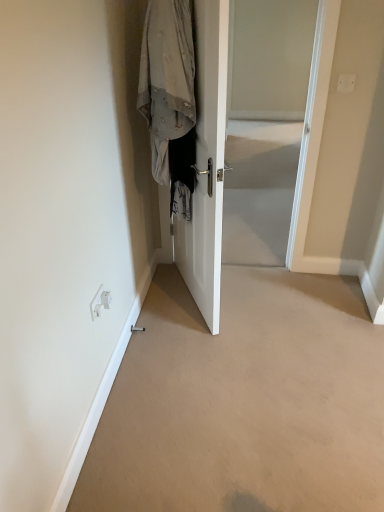
Measure the distance between light gray fabric coat at center and camera.

light gray fabric coat at center is 5.42 feet from camera.

What do you see at coordinates (207, 162) in the screenshot?
I see `white glossy door at center` at bounding box center [207, 162].

You are a GUI agent. You are given a task and a screenshot of the screen. Output one action in this format:
    pyautogui.click(x=<x>, y=<y>)
    Task: Click on the transparent glass door at center
    
    Given the screenshot: What is the action you would take?
    pyautogui.click(x=265, y=124)

What is the approximate height of white plastic electric outlet at lower left?

white plastic electric outlet at lower left is 3.39 inches in height.

Locate an element on the screen. The width and height of the screenshot is (384, 512). light gray fabric coat at center is located at coordinates (170, 97).

Which is in front, point (98, 291) or point (156, 134)?

The point (98, 291) is closer to the camera.

From the image's perspective, is white plastic electric outlet at lower left above or below light gray fabric coat at center?

white plastic electric outlet at lower left is below light gray fabric coat at center.

From a real-world perspective, is white plastic electric outlet at lower left on top of light gray fabric coat at center?

No, from a real-world perspective, white plastic electric outlet at lower left is not over light gray fabric coat at center

Which of these two, white plastic electric outlet at lower left or light gray fabric coat at center, is wider?

light gray fabric coat at center.

What's the angular difference between beige carpet at lower center and white plastic electric outlet at lower left's facing directions?

89.6 degrees.

Considering the sizes of beige carpet at lower center and white plastic electric outlet at lower left in the image, is beige carpet at lower center bigger or smaller than white plastic electric outlet at lower left?

Considering their sizes, beige carpet at lower center takes up more space than white plastic electric outlet at lower left.

Can you see beige carpet at lower center touching white plastic electric outlet at lower left?

No, beige carpet at lower center is not making contact with white plastic electric outlet at lower left.

From the image's perspective, which is below, beige carpet at lower center or white plastic electric outlet at lower left?

beige carpet at lower center, from the image's perspective.

Are light gray fabric coat at center and white plastic electric outlet at lower left beside each other?

No, light gray fabric coat at center is not next to white plastic electric outlet at lower left.

Considering the positions of objects light gray fabric coat at center and white plastic electric outlet at lower left in the image provided, who is more to the left, light gray fabric coat at center or white plastic electric outlet at lower left?

From the viewer's perspective, white plastic electric outlet at lower left appears more on the left side.

How many degrees apart are the facing directions of light gray fabric coat at center and white plastic electric outlet at lower left?

157 degrees separate the facing orientations of light gray fabric coat at center and white plastic electric outlet at lower left.

Identify the location of clothing located above the white plastic electric outlet at lower left (from a real-world perspective). (170, 97).

Image resolution: width=384 pixels, height=512 pixels. In order to click on clothing on the left of beige carpet at lower center in this screenshot , I will do `click(170, 97)`.

What's the angular difference between beige carpet at lower center and light gray fabric coat at center's facing directions?

There is a 113-degree angle between the facing directions of beige carpet at lower center and light gray fabric coat at center.

Considering their positions, is beige carpet at lower center located in front of or behind light gray fabric coat at center?

In the image, beige carpet at lower center appears in front of light gray fabric coat at center.

From the picture: Would you consider beige carpet at lower center to be distant from light gray fabric coat at center?

That's right, there is a large distance between beige carpet at lower center and light gray fabric coat at center.

Image resolution: width=384 pixels, height=512 pixels. Find the location of `clothing on the left side of white glossy door at center`. clothing on the left side of white glossy door at center is located at coordinates (170, 97).

Which object is wider, white glossy door at center or light gray fabric coat at center?

Wider between the two is light gray fabric coat at center.

Consider the image. Could you tell me if white glossy door at center is turned towards light gray fabric coat at center?

Yes.

How much distance is there between white glossy door at center and light gray fabric coat at center?

white glossy door at center and light gray fabric coat at center are 6.30 inches apart.

Considering the sizes of white glossy door at center and transparent glass door at center in the image, is white glossy door at center taller or shorter than transparent glass door at center?

Considering their sizes, white glossy door at center has more height than transparent glass door at center.

Is white glossy door at center closer to camera compared to transparent glass door at center?

Answer: Yes, it is.

Looking at their sizes, would you say white glossy door at center is wider or thinner than transparent glass door at center?

In the image, white glossy door at center appears to be more narrow than transparent glass door at center.

Is white glossy door at center bigger than transparent glass door at center?

Correct, white glossy door at center is larger in size than transparent glass door at center.

You are a GUI agent. You are given a task and a screenshot of the screen. Output one action in this format:
    pyautogui.click(x=<x>, y=<y>)
    Task: Click on the corridor in front of the transparent glass door at center
    
    Given the screenshot: What is the action you would take?
    pyautogui.click(x=244, y=401)

From the image's perspective, would you say transparent glass door at center is positioned over beige carpet at lower center?

Yes.

Is point (264, 10) closer or farther from the camera than point (269, 345)?

Point (264, 10).

Between transparent glass door at center and beige carpet at lower center, which one appears on the left side from the viewer's perspective?

beige carpet at lower center.

This screenshot has height=512, width=384. In the image, there is a white plastic electric outlet at lower left. What are the coordinates of `clothing above it (from the image's perspective)` in the screenshot? It's located at (170, 97).

In order to click on electric outlet on the left of beige carpet at lower center in this screenshot , I will do `click(100, 302)`.

Based on their spatial positions, is beige carpet at lower center or white glossy door at center further from light gray fabric coat at center?

beige carpet at lower center is further to light gray fabric coat at center.

Considering their positions, is white glossy door at center positioned further to transparent glass door at center than white plastic electric outlet at lower left?

white plastic electric outlet at lower left is further to transparent glass door at center.

Based on their spatial positions, is white glossy door at center or transparent glass door at center further from white plastic electric outlet at lower left?

transparent glass door at center lies further to white plastic electric outlet at lower left than the other object.

Estimate the real-world distances between objects in this image. Which object is further from white plastic electric outlet at lower left, white glossy door at center or beige carpet at lower center?

Based on the image, beige carpet at lower center appears to be further to white plastic electric outlet at lower left.

Which object lies further to the anchor point white plastic electric outlet at lower left, light gray fabric coat at center or white glossy door at center?

Based on the image, light gray fabric coat at center appears to be further to white plastic electric outlet at lower left.

From the image, which object appears to be nearer to light gray fabric coat at center, transparent glass door at center or white glossy door at center?

white glossy door at center is positioned closer to the anchor light gray fabric coat at center.

From the image, which object appears to be nearer to transparent glass door at center, beige carpet at lower center or white glossy door at center?

white glossy door at center lies closer to transparent glass door at center than the other object.

When comparing their distances from beige carpet at lower center, does light gray fabric coat at center or transparent glass door at center seem further?

transparent glass door at center.

This screenshot has width=384, height=512. Identify the location of electric outlet that lies between transparent glass door at center and beige carpet at lower center from top to bottom. (100, 302).

Identify the location of clothing positioned between white glossy door at center and transparent glass door at center from near to far. (170, 97).

Where is `door that lies between transparent glass door at center and white plastic electric outlet at lower left from top to bottom`? This screenshot has width=384, height=512. door that lies between transparent glass door at center and white plastic electric outlet at lower left from top to bottom is located at coordinates (207, 162).

Locate an element on the screen. electric outlet between light gray fabric coat at center and beige carpet at lower center in the vertical direction is located at coordinates (100, 302).